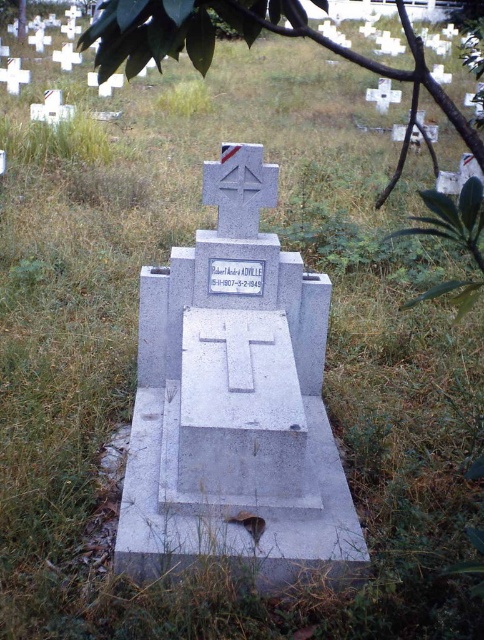
Question: Does gray concrete cross at center appear on the right side of green leafy tree at upper center?

Choices:
 (A) no
 (B) yes

Answer: (B)

Question: Does gray concrete cross at center have a greater width compared to green leafy tree at upper center?

Choices:
 (A) yes
 (B) no

Answer: (B)

Question: Which point is farther to the camera?

Choices:
 (A) (200, 408)
 (B) (349, 54)

Answer: (A)

Question: Which object appears farthest from the camera in this image?

Choices:
 (A) gray concrete cross at center
 (B) green leafy tree at upper center

Answer: (A)

Question: Which point appears farthest from the camera in this image?

Choices:
 (A) (179, 28)
 (B) (288, 444)

Answer: (B)

Question: Does gray concrete cross at center appear on the left side of green leafy tree at upper center?

Choices:
 (A) no
 (B) yes

Answer: (A)